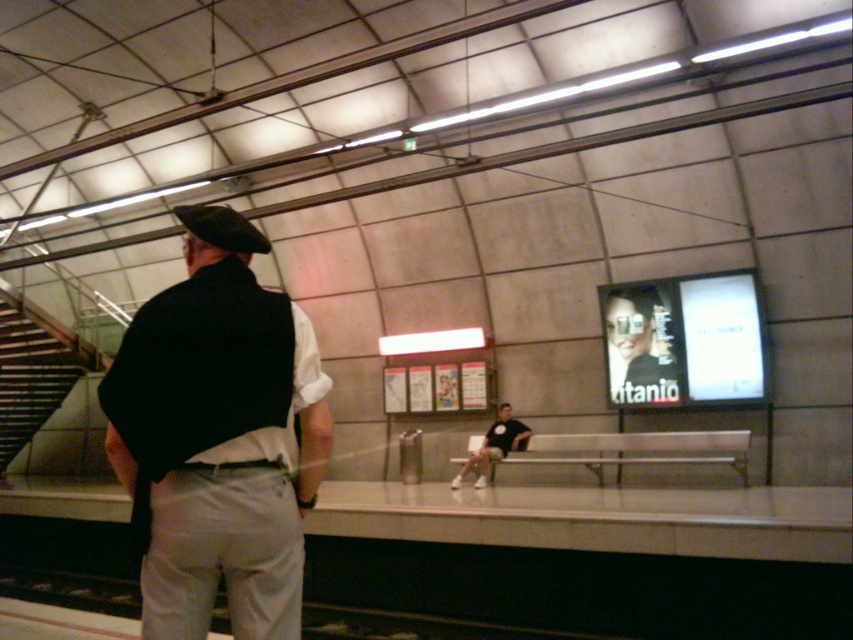
Is wooden stairs at left positioned behind black t-shirt at center?

Yes, it is behind black t-shirt at center.

Between wooden stairs at left and black t-shirt at center, which one appears on the right side from the viewer's perspective?

black t-shirt at center is more to the right.

The width and height of the screenshot is (853, 640). Find the location of `wooden stairs at left`. wooden stairs at left is located at coordinates (33, 369).

Identify the location of wooden stairs at left. (33, 369).

Does point (322, 387) come farther from viewer compared to point (485, 451)?

No.

Who is positioned more to the right, dark gray fabric vest at center or black t-shirt at center?

From the viewer's perspective, black t-shirt at center appears more on the right side.

The width and height of the screenshot is (853, 640). Identify the location of dark gray fabric vest at center. (218, 436).

Locate an element on the screen. The width and height of the screenshot is (853, 640). dark gray fabric vest at center is located at coordinates (218, 436).

Is dark gray fabric vest at center thinner than wooden stairs at left?

Indeed, dark gray fabric vest at center has a lesser width compared to wooden stairs at left.

Does dark gray fabric vest at center appear under wooden stairs at left?

Actually, dark gray fabric vest at center is above wooden stairs at left.

Is point (183, 636) positioned in front of point (80, 353)?

Yes, it is.

The image size is (853, 640). I want to click on dark gray fabric vest at center, so click(218, 436).